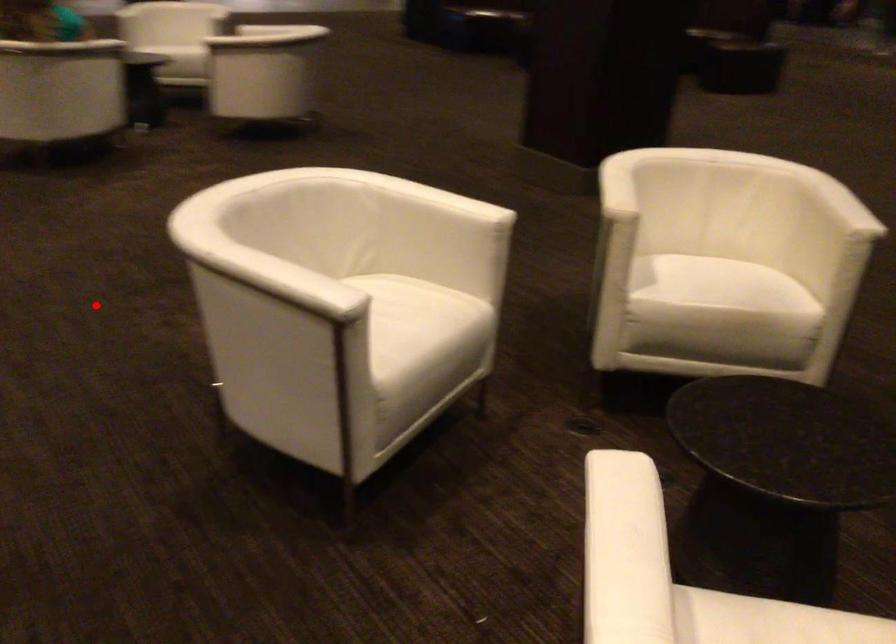
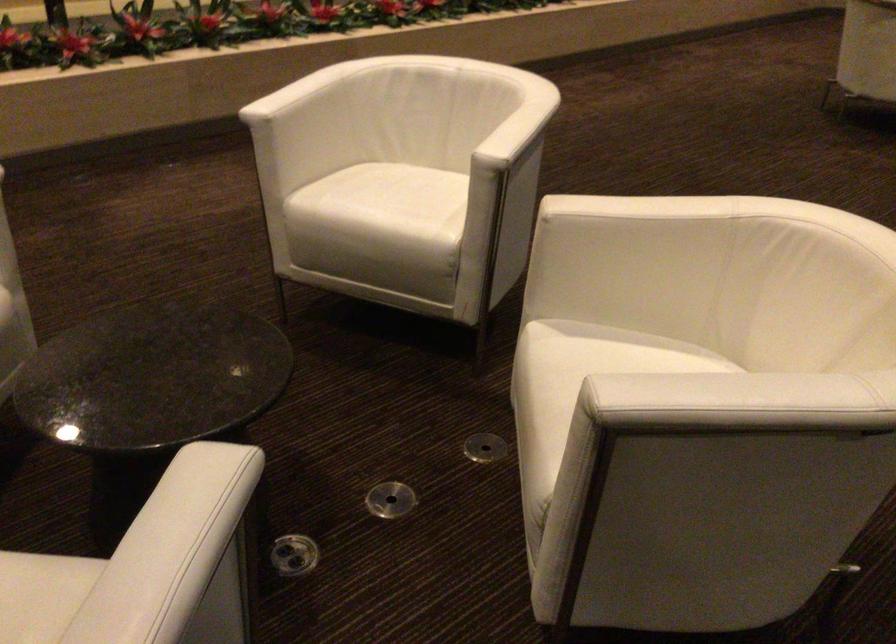
The point at the highlighted location is marked in the first image. Where is the corresponding point in the second image?

(571, 180)